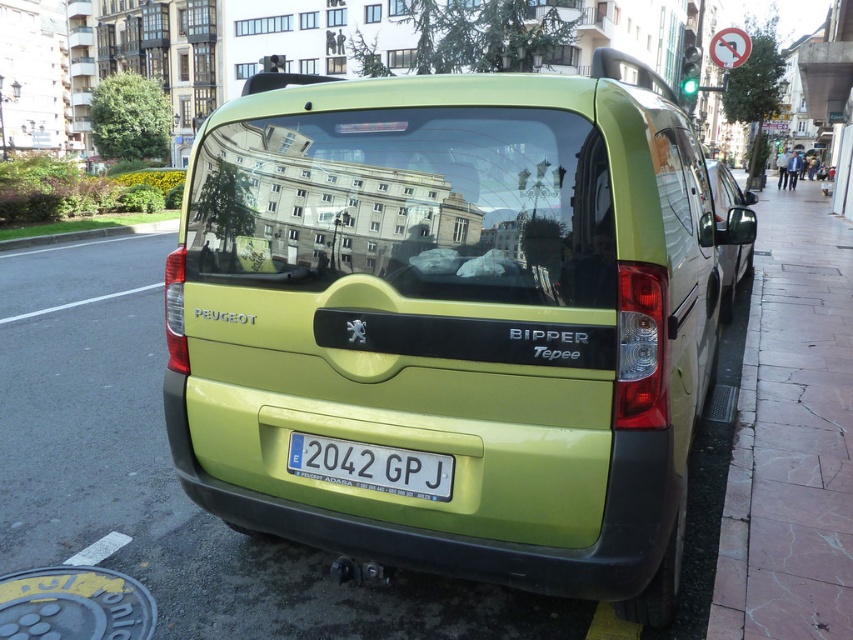
Question: Which of the following is the closest to the observer?

Choices:
 (A) lime matte van at center
 (B) white plastic license plate at center

Answer: (A)

Question: Does lime matte van at center have a lesser width compared to white plastic license plate at center?

Choices:
 (A) yes
 (B) no

Answer: (B)

Question: Does lime matte van at center have a larger size compared to green matte van at right?

Choices:
 (A) no
 (B) yes

Answer: (A)

Question: Is lime matte van at center closer to camera compared to white plastic license plate at center?

Choices:
 (A) yes
 (B) no

Answer: (A)

Question: Which point is farther from the camera taking this photo?

Choices:
 (A) (718, 260)
 (B) (422, 440)
 (C) (347, 477)

Answer: (A)

Question: Which point is closer to the camera?

Choices:
 (A) green matte van at right
 (B) lime matte van at center

Answer: (B)